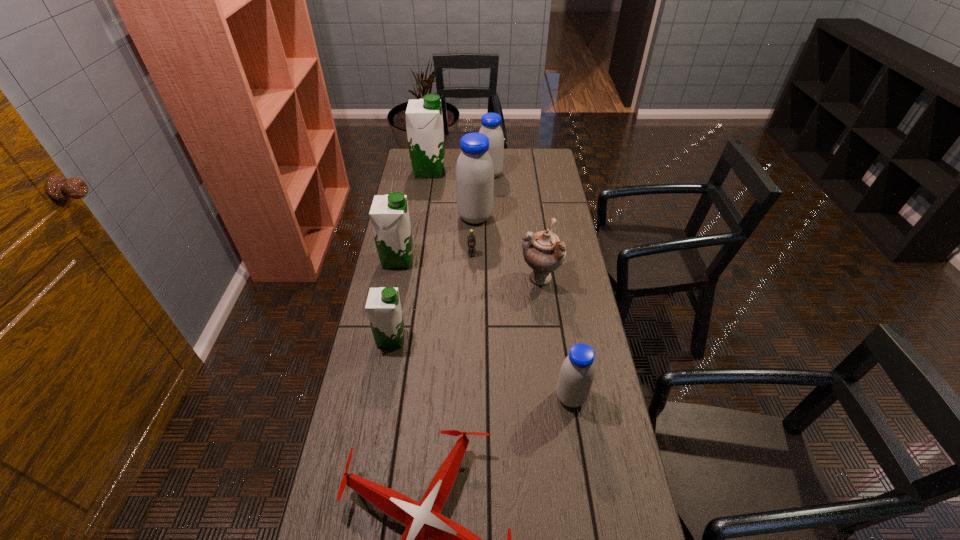
What are the coordinates of `the nearest soya milk` in the screenshot? It's located at (577, 372).

Image resolution: width=960 pixels, height=540 pixels. In order to click on the eighth tallest object in this screenshot , I will do `click(471, 238)`.

This screenshot has height=540, width=960. Identify the location of green soda. (471, 238).

Find the location of `vacant position located 0.070m on the front-facing side of the biggest green soya milk`. vacant position located 0.070m on the front-facing side of the biggest green soya milk is located at coordinates tap(460, 171).

Locate an element on the screen. free space located 0.250m on the left of the seventh nearest object is located at coordinates (400, 217).

The width and height of the screenshot is (960, 540). In order to click on free space located on the front of the second biggest blue soya milk in this screenshot , I will do `click(491, 191)`.

What are the coordinates of `vacant area situated on the front-facing side of the fourth farthest soya milk` in the screenshot? It's located at [x=501, y=260].

Identify the location of vacant region located 0.090m on the front of the urn. This screenshot has width=960, height=540. (544, 313).

The height and width of the screenshot is (540, 960). I want to click on free space located 0.070m on the front-facing side of the nearest green soya milk, so coord(427,339).

Locate an element on the screen. This screenshot has height=540, width=960. vacant area located 0.240m on the left of the rightmost blue soya milk is located at coordinates (474, 397).